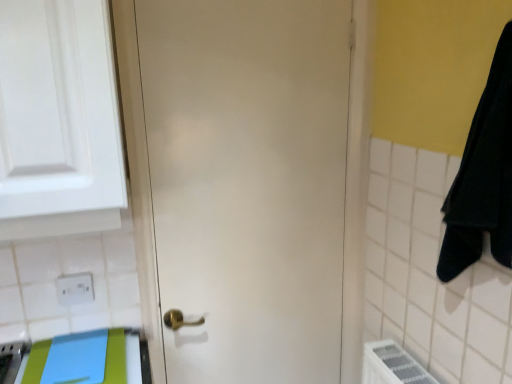
Question: Is blue fabric beach towel at lower left far from white glossy cabinet at upper left?

Choices:
 (A) no
 (B) yes

Answer: (A)

Question: Is blue fabric beach towel at lower left not within white glossy cabinet at upper left?

Choices:
 (A) yes
 (B) no

Answer: (A)

Question: Does blue fabric beach towel at lower left have a lesser height compared to white glossy cabinet at upper left?

Choices:
 (A) no
 (B) yes

Answer: (B)

Question: Is blue fabric beach towel at lower left positioned with its back to white glossy cabinet at upper left?

Choices:
 (A) yes
 (B) no

Answer: (B)

Question: From a real-world perspective, is blue fabric beach towel at lower left positioned under white glossy cabinet at upper left based on gravity?

Choices:
 (A) yes
 (B) no

Answer: (A)

Question: Considering the relative positions of blue fabric beach towel at lower left and white glossy cabinet at upper left in the image provided, is blue fabric beach towel at lower left to the left of white glossy cabinet at upper left from the viewer's perspective?

Choices:
 (A) no
 (B) yes

Answer: (B)

Question: From a real-world perspective, does white matte door at center sit lower than white plastic electric outlet at lower left?

Choices:
 (A) yes
 (B) no

Answer: (B)

Question: Is white matte door at center bigger than white plastic electric outlet at lower left?

Choices:
 (A) no
 (B) yes

Answer: (B)

Question: Is the position of white matte door at center less distant than that of white plastic electric outlet at lower left?

Choices:
 (A) yes
 (B) no

Answer: (A)

Question: From the image's perspective, is white matte door at center below white plastic electric outlet at lower left?

Choices:
 (A) yes
 (B) no

Answer: (B)

Question: Would you say white plastic electric outlet at lower left is part of white matte door at center's contents?

Choices:
 (A) yes
 (B) no

Answer: (B)

Question: Is white matte door at center at the left side of white plastic electric outlet at lower left?

Choices:
 (A) no
 (B) yes

Answer: (A)

Question: Does blue fabric beach towel at lower left have a lesser width compared to white matte door at center?

Choices:
 (A) no
 (B) yes

Answer: (A)